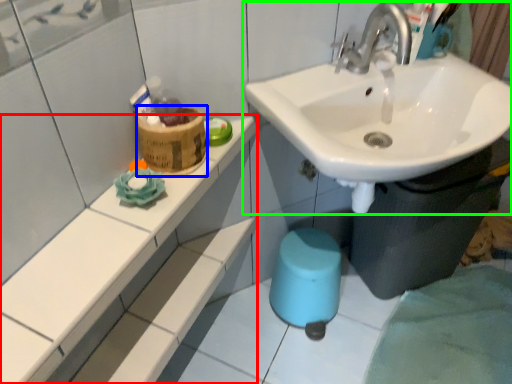
Question: Based on their relative distances, which object is farther from counter top (highlighted by a red box)? Choose from potty (highlighted by a blue box) and sink (highlighted by a green box).

Choices:
 (A) potty
 (B) sink

Answer: (B)